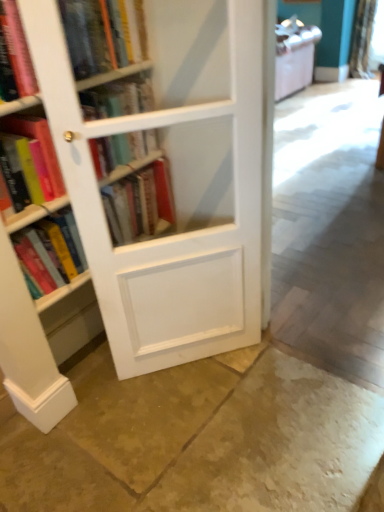
Question: Does smooth concrete floor at center, the 2th concrete in the bottom-to-top sequence, have a greater width compared to hardcover book at left, arranged as the third book when ordered from the bottom?

Choices:
 (A) yes
 (B) no

Answer: (B)

Question: Is smooth concrete floor at center, arranged as the first concrete when viewed from the top, at the right side of hardcover book at left, which appears as the fourth book when viewed from the top?

Choices:
 (A) no
 (B) yes

Answer: (B)

Question: Can you confirm if smooth concrete floor at center, arranged as the first concrete when viewed from the top, is thinner than hardcover book at left, which appears as the fourth book when viewed from the top?

Choices:
 (A) yes
 (B) no

Answer: (A)

Question: Is smooth concrete floor at center, the 2th concrete in the bottom-to-top sequence, at the left side of hardcover book at left, which appears as the fourth book when viewed from the top?

Choices:
 (A) yes
 (B) no

Answer: (B)

Question: From a real-world perspective, is smooth concrete floor at center, the 2th concrete in the bottom-to-top sequence, positioned under hardcover book at left, which appears as the fourth book when viewed from the top, based on gravity?

Choices:
 (A) no
 (B) yes

Answer: (B)

Question: From the image's perspective, does hardcover book at left, marked as the 4th book in a bottom-to-top arrangement, appear lower than smooth concrete floor at center, the 2th concrete in the bottom-to-top sequence?

Choices:
 (A) no
 (B) yes

Answer: (A)

Question: Could you tell me if hardcover book at left, marked as the 4th book in a bottom-to-top arrangement, is facing smooth concrete floor at center, the 2th concrete in the bottom-to-top sequence?

Choices:
 (A) no
 (B) yes

Answer: (B)

Question: Can you confirm if hardcover book at left, marked as the 4th book in a bottom-to-top arrangement, is bigger than smooth concrete floor at center, the 2th concrete in the bottom-to-top sequence?

Choices:
 (A) no
 (B) yes

Answer: (A)

Question: From the image's perspective, is hardcover book at left, which is the 3th book from top to bottom, over smooth concrete floor at center, arranged as the first concrete when viewed from the top?

Choices:
 (A) no
 (B) yes

Answer: (B)

Question: From a real-world perspective, is hardcover book at left, marked as the 4th book in a bottom-to-top arrangement, below smooth concrete floor at center, arranged as the first concrete when viewed from the top?

Choices:
 (A) yes
 (B) no

Answer: (B)

Question: Considering the relative positions of hardcover book at left, which is the 3th book from top to bottom, and smooth concrete floor at center, arranged as the first concrete when viewed from the top, in the image provided, is hardcover book at left, which is the 3th book from top to bottom, to the right of smooth concrete floor at center, arranged as the first concrete when viewed from the top, from the viewer's perspective?

Choices:
 (A) no
 (B) yes

Answer: (A)

Question: Could you tell me if white wood bookcase at left is facing white sheer curtain at upper right?

Choices:
 (A) no
 (B) yes

Answer: (A)